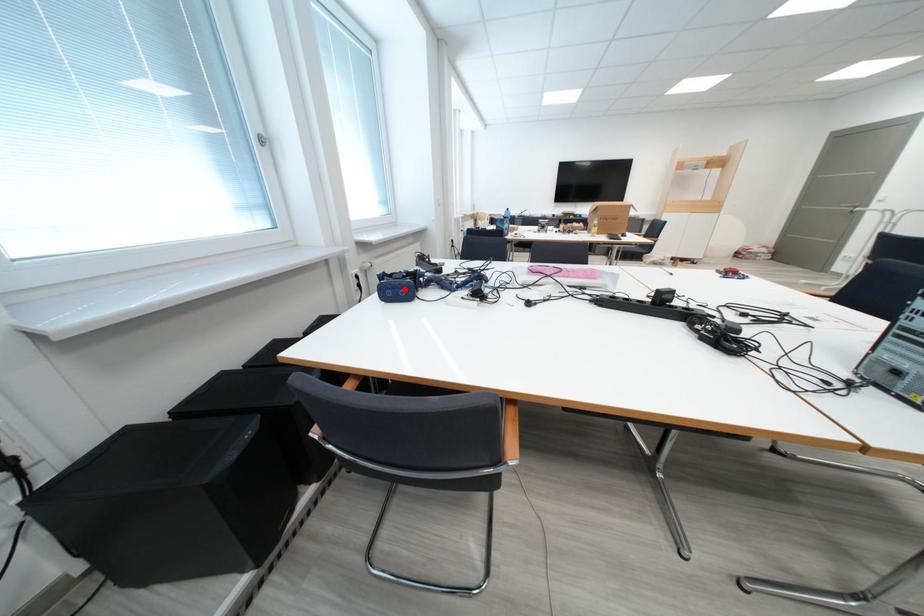
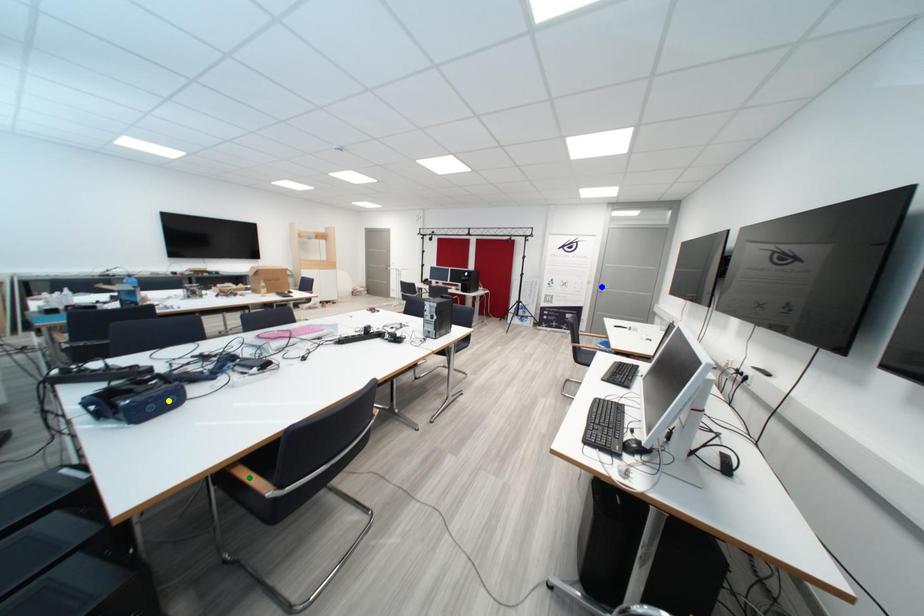
Question: I am providing you with two images of the same scene from different viewpoints. A red point is marked on the first image. You are given multiple points on the second image. Can you choose the point in image 2 that corresponds to the point in image 1?

Choices:
 (A) yellow point
 (B) green point
 (C) blue point

Answer: (A)